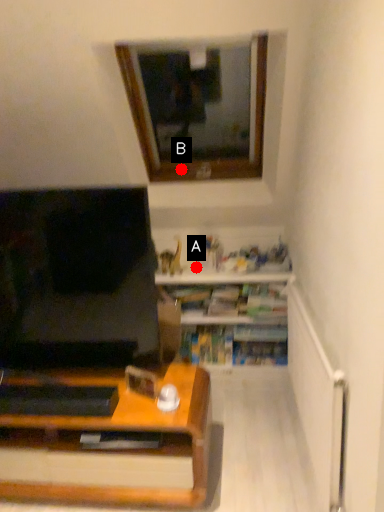
Question: Two points are circled on the image, labeled by A and B beside each circle. Among these points, which one is farthest from the camera?

Choices:
 (A) A is further
 (B) B is further

Answer: (B)